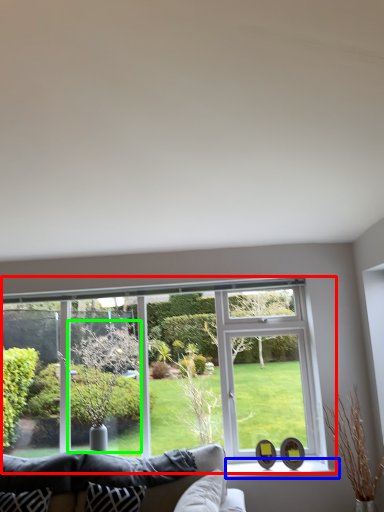
Question: Based on their relative distances, which object is farther from window (highlighted by a red box)? Choose from window sill (highlighted by a blue box) and tree (highlighted by a green box).

Choices:
 (A) window sill
 (B) tree

Answer: (A)